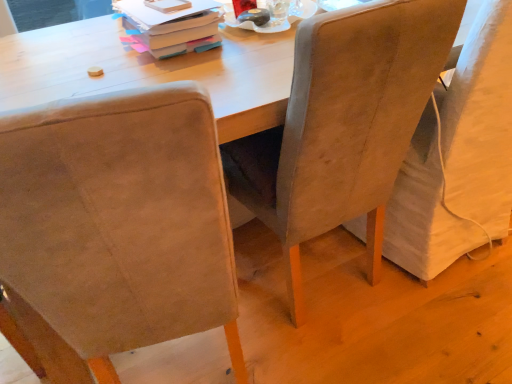
Question: Is matte cardboard book at upper center spatially inside suede-like beige chair at center, which is the second chair from right to left, or outside of it?

Choices:
 (A) inside
 (B) outside

Answer: (B)

Question: From a real-world perspective, is matte cardboard book at upper center above or below suede-like beige chair at center, which is the second chair from right to left?

Choices:
 (A) above
 (B) below

Answer: (A)

Question: Which is nearer to the suede-like beige chair at right, which is the 1th chair from right to left?

Choices:
 (A) suede-like beige chair at center, acting as the 2th chair starting from the left
 (B) suede-like beige chair at left, the first chair viewed from the left
 (C) matte cardboard book at upper center

Answer: (A)

Question: Estimate the real-world distances between objects in this image. Which object is closer to the suede-like beige chair at right, which is the 1th chair from right to left?

Choices:
 (A) suede-like beige chair at left, placed as the 3th chair when sorted from right to left
 (B) matte cardboard book at upper center
 (C) suede-like beige chair at center, which is the second chair from right to left

Answer: (C)